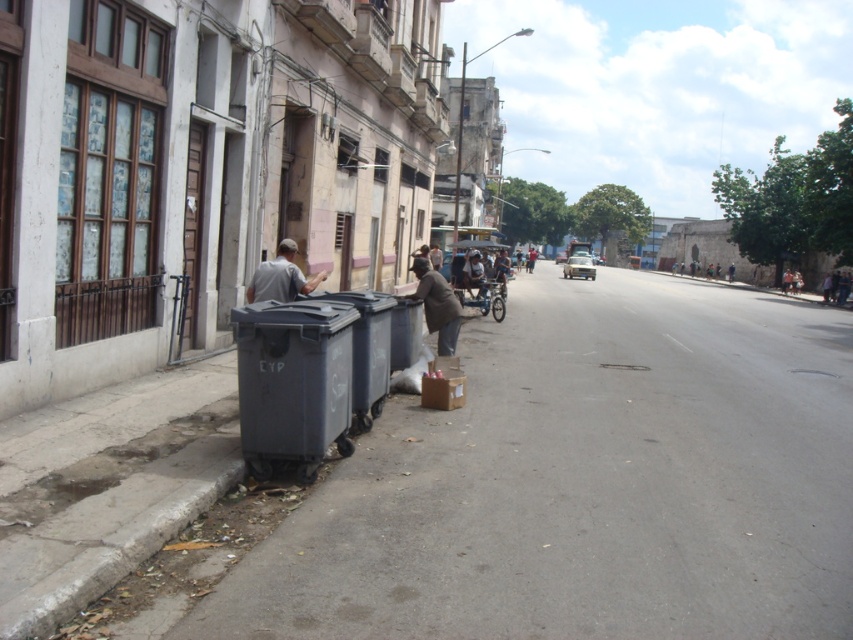
Question: Is matte gray trash can at lower left above metallic silver cart at center?

Choices:
 (A) yes
 (B) no

Answer: (B)

Question: Is matte black trash can at lower left bigger than gray matte shirt at center?

Choices:
 (A) no
 (B) yes

Answer: (B)

Question: Estimate the real-world distances between objects in this image. Which object is closer to the matte gray trash can at lower left?

Choices:
 (A) gray concrete pavement at lower left
 (B) metallic silver cart at center

Answer: (A)

Question: Is gray concrete curb at lower left further to the viewer compared to metallic silver cart at center?

Choices:
 (A) no
 (B) yes

Answer: (A)

Question: Which point appears farthest from the camera in this image?

Choices:
 (A) (125, 529)
 (B) (416, 294)
 (C) (740, 321)

Answer: (C)

Question: Which of the following is the closest to the observer?

Choices:
 (A) (415, 260)
 (B) (819, 572)
 (C) (265, 285)
 (D) (341, 316)

Answer: (B)